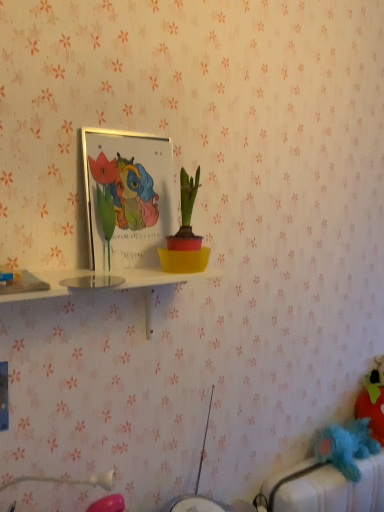
In order to face metallic frame at center, should I rotate leftwards or rightwards?

To align with it, rotate left about 7.606°.

At what (x,y) coordinates should I click in order to perform the action: click on metallic frame at center. Please return your answer as a coordinate pair (x, y). The width and height of the screenshot is (384, 512). Looking at the image, I should click on (127, 197).

What do you see at coordinates (127, 197) in the screenshot? I see `metallic frame at center` at bounding box center [127, 197].

Identify the location of metallic frame at center. (127, 197).